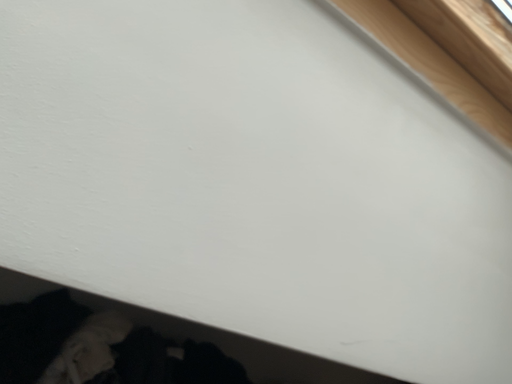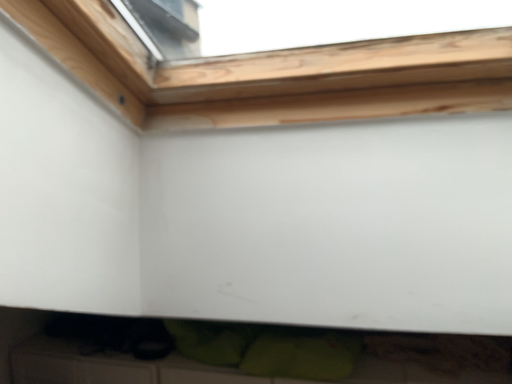
Question: How did the camera likely rotate when shooting the video?

Choices:
 (A) rotated left
 (B) rotated right

Answer: (B)